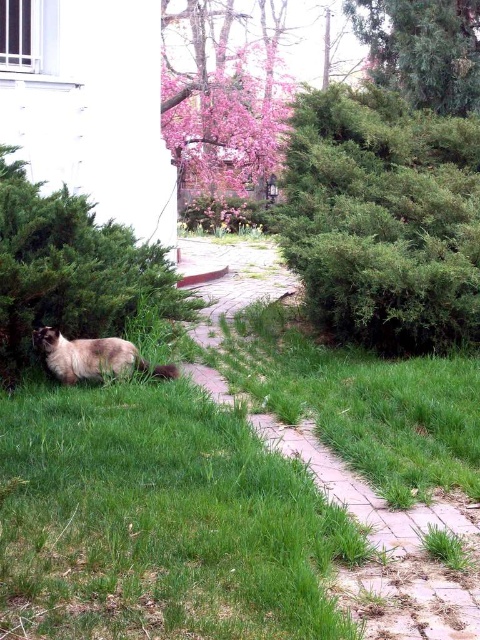
Does point (447, 118) come behind point (217, 314)?

No, (447, 118) is closer to viewer.

Who is taller, green textured bush at center or green grass at center?

Standing taller between the two is green textured bush at center.

Locate an element on the screen. This screenshot has width=480, height=640. green textured bush at center is located at coordinates (384, 220).

Where is `green textured bush at center`? Image resolution: width=480 pixels, height=640 pixels. green textured bush at center is located at coordinates (384, 220).

In the scene shown: Which of these two, green leafy bush at lower left or green textured bush at upper right, stands shorter?

green leafy bush at lower left is shorter.

Is point (158, 244) farther from camera compared to point (361, 4)?

No, (158, 244) is in front of (361, 4).

The image size is (480, 640). I want to click on green leafy bush at lower left, so click(x=72, y=269).

Can you confirm if green grass at center is positioned below pink blossom tree at upper center?

Indeed, green grass at center is positioned under pink blossom tree at upper center.

This screenshot has height=640, width=480. What do you see at coordinates (389, 545) in the screenshot? I see `green grass at center` at bounding box center [389, 545].

Locate an element on the screen. The width and height of the screenshot is (480, 640). green grass at center is located at coordinates click(x=389, y=545).